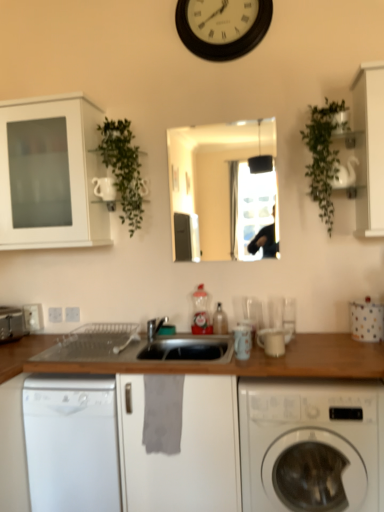
Identify the location of vacant area that is situated to the right of white ceramic mug at center, which is counted as the 3th appliance, starting from the back. The height and width of the screenshot is (512, 384). (308, 355).